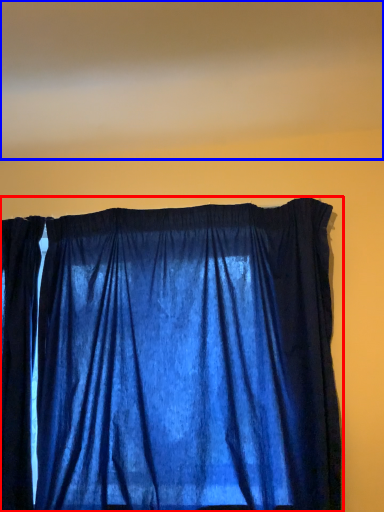
Question: Which of the following is the farthest to the observer, curtain (highlighted by a red box) or blind (highlighted by a blue box)?

Choices:
 (A) curtain
 (B) blind

Answer: (A)